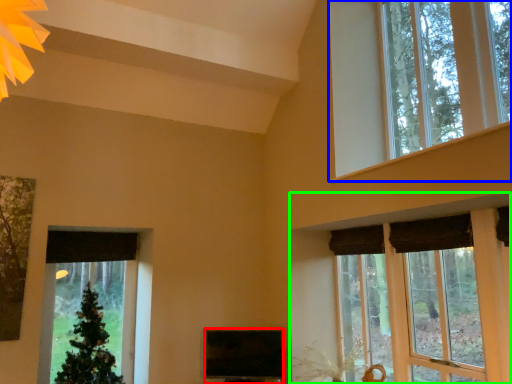
Question: Estimate the real-world distances between objects in this image. Which object is closer to window screen (highlighted by a red box), window (highlighted by a blue box) or window (highlighted by a green box)?

Choices:
 (A) window
 (B) window

Answer: (B)